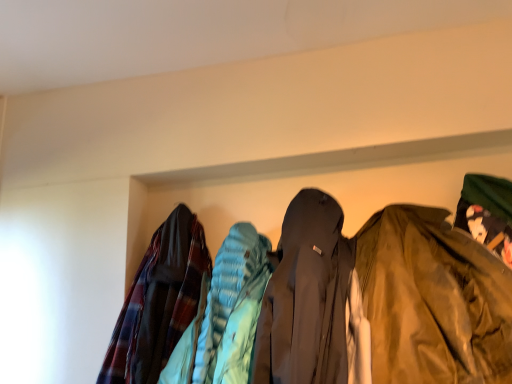
Question: Visually, is plaid fabric jacket at left, the first jacket from the left, positioned to the left or to the right of shiny olive-green jacket at right, which appears as the second jacket when viewed from the left?

Choices:
 (A) left
 (B) right

Answer: (A)

Question: Is plaid fabric jacket at left, the first jacket from the left, bigger or smaller than shiny olive-green jacket at right, which ranks as the 1th jacket in right-to-left order?

Choices:
 (A) small
 (B) big

Answer: (A)

Question: Is plaid fabric jacket at left, marked as the second jacket in a right-to-left arrangement, spatially inside shiny olive-green jacket at right, which appears as the second jacket when viewed from the left, or outside of it?

Choices:
 (A) outside
 (B) inside

Answer: (A)

Question: In terms of width, does shiny olive-green jacket at right, which appears as the second jacket when viewed from the left, look wider or thinner when compared to plaid fabric jacket at left, the first jacket from the left?

Choices:
 (A) wide
 (B) thin

Answer: (A)

Question: From the image's perspective, is shiny olive-green jacket at right, which ranks as the 1th jacket in right-to-left order, positioned above or below plaid fabric jacket at left, the first jacket from the left?

Choices:
 (A) below
 (B) above

Answer: (B)

Question: Relative to plaid fabric jacket at left, marked as the second jacket in a right-to-left arrangement, is shiny olive-green jacket at right, which ranks as the 1th jacket in right-to-left order, in front or behind?

Choices:
 (A) behind
 (B) front

Answer: (B)

Question: In terms of height, does shiny olive-green jacket at right, which ranks as the 1th jacket in right-to-left order, look taller or shorter compared to plaid fabric jacket at left, marked as the second jacket in a right-to-left arrangement?

Choices:
 (A) tall
 (B) short

Answer: (B)